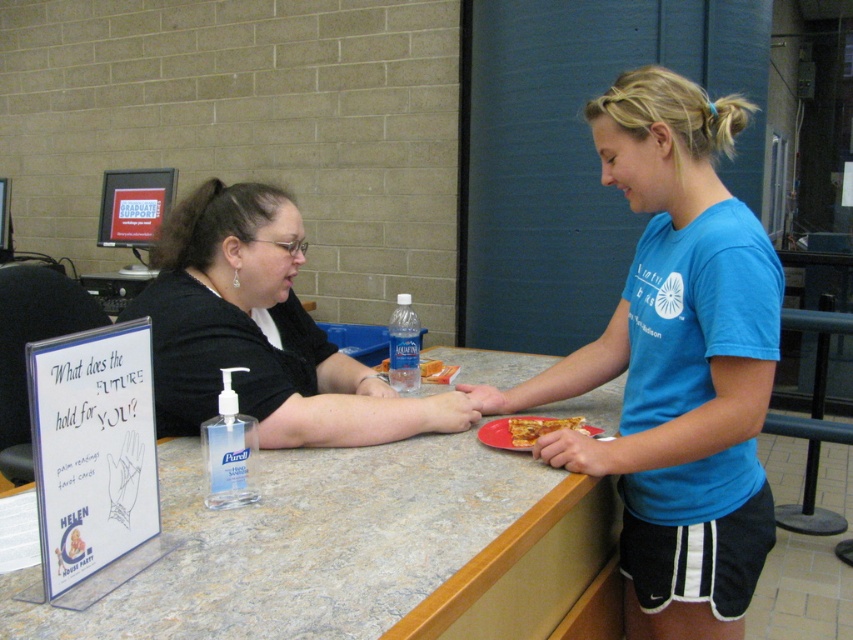
Question: Among these objects, which one is nearest to the camera?

Choices:
 (A) black fabric shirt at center
 (B) golden crispy pizza slice at center

Answer: (A)

Question: Which point is farther to the camera?

Choices:
 (A) marble countertop at center
 (B) blue cotton shirt at center
 (C) black fabric shirt at center

Answer: (C)

Question: Which point is farther from the camera taking this photo?

Choices:
 (A) (221, 204)
 (B) (556, 422)
 (C) (570, 396)
 (D) (378, 449)

Answer: (C)

Question: Is the position of black fabric shirt at center less distant than that of golden crispy pizza slice at center?

Choices:
 (A) yes
 (B) no

Answer: (A)

Question: Does blue cotton shirt at center have a smaller size compared to black fabric shirt at center?

Choices:
 (A) no
 (B) yes

Answer: (A)

Question: Does blue cotton shirt at center come in front of golden crispy pizza slice at center?

Choices:
 (A) yes
 (B) no

Answer: (A)